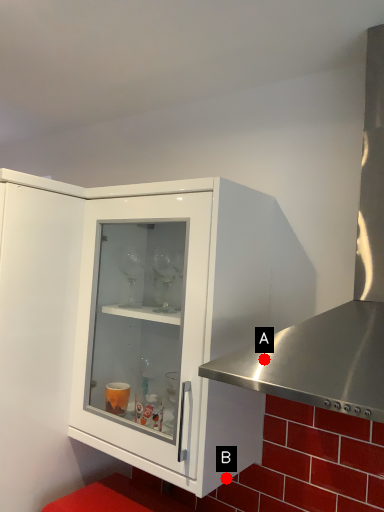
Question: Two points are circled on the image, labeled by A and B beside each circle. Among these points, which one is farthest from the camera?

Choices:
 (A) A is further
 (B) B is further

Answer: (B)